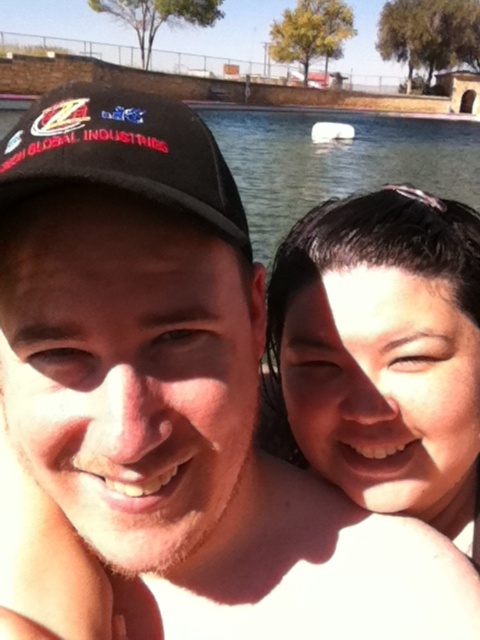
Question: Can you confirm if smooth skin face at upper right is positioned to the left of black fabric baseball cap at upper left?

Choices:
 (A) yes
 (B) no

Answer: (B)

Question: Is smooth skin face at upper right smaller than black fabric baseball cap at upper left?

Choices:
 (A) no
 (B) yes

Answer: (B)

Question: Which point appears closest to the camera in this image?

Choices:
 (A) (442, 397)
 (B) (76, 150)

Answer: (B)

Question: Observing the image, what is the correct spatial positioning of smooth skin face at upper right in reference to black fabric baseball cap at upper left?

Choices:
 (A) right
 (B) left

Answer: (A)

Question: Which point is closer to the camera taking this photo?

Choices:
 (A) (458, 312)
 (B) (154, 124)

Answer: (B)